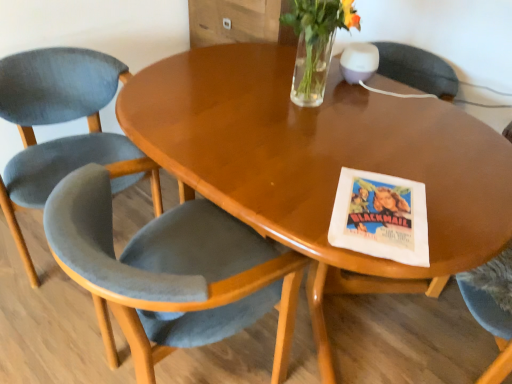
Identify the location of velvet grey chair at left, the first chair positioned from the left. This screenshot has width=512, height=384. (62, 122).

This screenshot has height=384, width=512. What do you see at coordinates (316, 44) in the screenshot? I see `clear glass vase at upper center` at bounding box center [316, 44].

This screenshot has height=384, width=512. Find the location of `velvet grey chair at left, which is counted as the 2th chair, starting from the right`. velvet grey chair at left, which is counted as the 2th chair, starting from the right is located at coordinates (62, 122).

Does glossy wood table at center have a lesser width compared to velvet grey chair at lower left, marked as the 2th chair in a left-to-right arrangement?

No, glossy wood table at center is not thinner than velvet grey chair at lower left, marked as the 2th chair in a left-to-right arrangement.

Is point (225, 138) behind point (252, 247)?

No, it is not.

Are glossy wood table at center and velvet grey chair at lower left, marked as the 2th chair in a left-to-right arrangement, beside each other?

No, glossy wood table at center is not beside velvet grey chair at lower left, marked as the 2th chair in a left-to-right arrangement.

From the image's perspective, would you say glossy wood table at center is positioned over velvet grey chair at lower left, marked as the 2th chair in a left-to-right arrangement?

No, from the image's perspective, glossy wood table at center is not on top of velvet grey chair at lower left, marked as the 2th chair in a left-to-right arrangement.

Which is correct: glossy wood table at center is inside velvet grey chair at left, which is counted as the 2th chair, starting from the right, or outside of it?

glossy wood table at center is not enclosed by velvet grey chair at left, which is counted as the 2th chair, starting from the right.

Which object is positioned more to the left, glossy wood table at center or velvet grey chair at left, the first chair positioned from the left?

Positioned to the left is velvet grey chair at left, the first chair positioned from the left.

Can you confirm if glossy wood table at center is thinner than velvet grey chair at left, the first chair positioned from the left?

No.

This screenshot has height=384, width=512. Identify the location of chair behind the clear glass vase at upper center. (62, 122).

Is clear glass vase at upper center bigger than velvet grey chair at left, the first chair positioned from the left?

Actually, clear glass vase at upper center might be smaller than velvet grey chair at left, the first chair positioned from the left.

Can you see clear glass vase at upper center touching velvet grey chair at left, which is counted as the 2th chair, starting from the right?

There is a gap between clear glass vase at upper center and velvet grey chair at left, which is counted as the 2th chair, starting from the right.

In the scene shown: Can you tell me how much clear glass vase at upper center and velvet grey chair at left, the first chair positioned from the left, differ in facing direction?

They differ by 72.3 degrees in their facing directions.

From the image's perspective, which chair is the 2nd one above the glossy wood table at center? Please provide its 2D coordinates.

[(62, 122)]

Consider the image. Which is more to the right, velvet grey chair at left, the first chair positioned from the left, or glossy wood table at center?

glossy wood table at center.

Is velvet grey chair at left, the first chair positioned from the left, not near glossy wood table at center?

They are positioned close to each other.

Is glossy wood table at center at the back of velvet grey chair at left, the first chair positioned from the left?

No, velvet grey chair at left, the first chair positioned from the left,'s orientation is not away from glossy wood table at center.

Is point (309, 69) less distant than point (490, 139)?

No, (309, 69) is further to viewer.

How different are the orientations of clear glass vase at upper center and glossy wood table at center in degrees?

clear glass vase at upper center and glossy wood table at center are facing 1.14 degrees away from each other.

Is clear glass vase at upper center oriented away from glossy wood table at center?

No, glossy wood table at center is not at the back of clear glass vase at upper center.

Would you say glossy wood table at center is part of clear glass vase at upper center's contents?

No, glossy wood table at center is not inside clear glass vase at upper center.

Which is farther, (69, 103) or (282, 21)?

The point (69, 103) is behind.

Is velvet grey chair at left, the first chair positioned from the left, looking in the opposite direction of clear glass vase at upper center?

That's not correct — velvet grey chair at left, the first chair positioned from the left, is not looking away from clear glass vase at upper center.

Measure the distance between velvet grey chair at left, which is counted as the 2th chair, starting from the right, and clear glass vase at upper center.

The distance of velvet grey chair at left, which is counted as the 2th chair, starting from the right, from clear glass vase at upper center is 33.91 inches.

Considering the relative positions of velvet grey chair at left, the first chair positioned from the left, and clear glass vase at upper center in the image provided, is velvet grey chair at left, the first chair positioned from the left, to the left of clear glass vase at upper center from the viewer's perspective?

Yes.

Can you confirm if velvet grey chair at left, which is counted as the 2th chair, starting from the right, is bigger than velvet grey chair at lower left, marked as the 2th chair in a left-to-right arrangement?

No, velvet grey chair at left, which is counted as the 2th chair, starting from the right, is not bigger than velvet grey chair at lower left, marked as the 2th chair in a left-to-right arrangement.

Is velvet grey chair at left, the first chair positioned from the left, at the right side of velvet grey chair at lower left, marked as the 2th chair in a left-to-right arrangement?

No.

Where is `chair to the right of velvet grey chair at left, the first chair positioned from the left`? chair to the right of velvet grey chair at left, the first chair positioned from the left is located at coordinates (170, 272).

Is velvet grey chair at left, which is counted as the 2th chair, starting from the right, facing towards velvet grey chair at lower left, the first chair viewed from the right?

Yes, velvet grey chair at left, which is counted as the 2th chair, starting from the right, is oriented towards velvet grey chair at lower left, the first chair viewed from the right.

There is a glossy wood table at center. Where is `the 1st chair above it (from the image's perspective)`? The image size is (512, 384). the 1st chair above it (from the image's perspective) is located at coordinates (170, 272).

From the glossy wood table at center, count the 2nd chair to the left and point to it. Please provide its 2D coordinates.

[(62, 122)]

Estimate the real-world distances between objects in this image. Which object is closer to velvet grey chair at left, which is counted as the 2th chair, starting from the right, velvet grey chair at lower left, the first chair viewed from the right, or glossy wood table at center?

glossy wood table at center is positioned closer to the anchor velvet grey chair at left, which is counted as the 2th chair, starting from the right.

Looking at this image, estimate the real-world distances between objects in this image. Which object is closer to velvet grey chair at left, which is counted as the 2th chair, starting from the right, glossy wood table at center or clear glass vase at upper center?

Among the two, glossy wood table at center is located nearer to velvet grey chair at left, which is counted as the 2th chair, starting from the right.

Which object lies nearer to the anchor point clear glass vase at upper center, glossy wood table at center or velvet grey chair at lower left, marked as the 2th chair in a left-to-right arrangement?

glossy wood table at center lies closer to clear glass vase at upper center than the other object.

When comparing their distances from clear glass vase at upper center, does velvet grey chair at left, which is counted as the 2th chair, starting from the right, or glossy wood table at center seem further?

velvet grey chair at left, which is counted as the 2th chair, starting from the right, lies further to clear glass vase at upper center than the other object.

When comparing their distances from velvet grey chair at left, which is counted as the 2th chair, starting from the right, does glossy wood table at center or velvet grey chair at lower left, marked as the 2th chair in a left-to-right arrangement, seem further?

Among the two, velvet grey chair at lower left, marked as the 2th chair in a left-to-right arrangement, is located further to velvet grey chair at left, which is counted as the 2th chair, starting from the right.

Based on their spatial positions, is clear glass vase at upper center or velvet grey chair at lower left, marked as the 2th chair in a left-to-right arrangement, closer to glossy wood table at center?

clear glass vase at upper center lies closer to glossy wood table at center than the other object.

Looking at this image, considering their positions, is velvet grey chair at lower left, marked as the 2th chair in a left-to-right arrangement, positioned further to glossy wood table at center than clear glass vase at upper center?

The object further to glossy wood table at center is velvet grey chair at lower left, marked as the 2th chair in a left-to-right arrangement.

When comparing their distances from clear glass vase at upper center, does velvet grey chair at lower left, the first chair viewed from the right, or velvet grey chair at left, the first chair positioned from the left, seem closer?

Among the two, velvet grey chair at lower left, the first chair viewed from the right, is located nearer to clear glass vase at upper center.

At what (x,y) coordinates should I click in order to perform the action: click on chair between velvet grey chair at left, which is counted as the 2th chair, starting from the right, and clear glass vase at upper center, in the horizontal direction. Please return your answer as a coordinate pair (x, y). This screenshot has width=512, height=384. Looking at the image, I should click on (170, 272).

Identify the location of chair situated between velvet grey chair at left, the first chair positioned from the left, and glossy wood table at center from left to right. (170, 272).

The height and width of the screenshot is (384, 512). I want to click on coffee table between velvet grey chair at left, which is counted as the 2th chair, starting from the right, and clear glass vase at upper center, in the horizontal direction, so click(x=318, y=158).